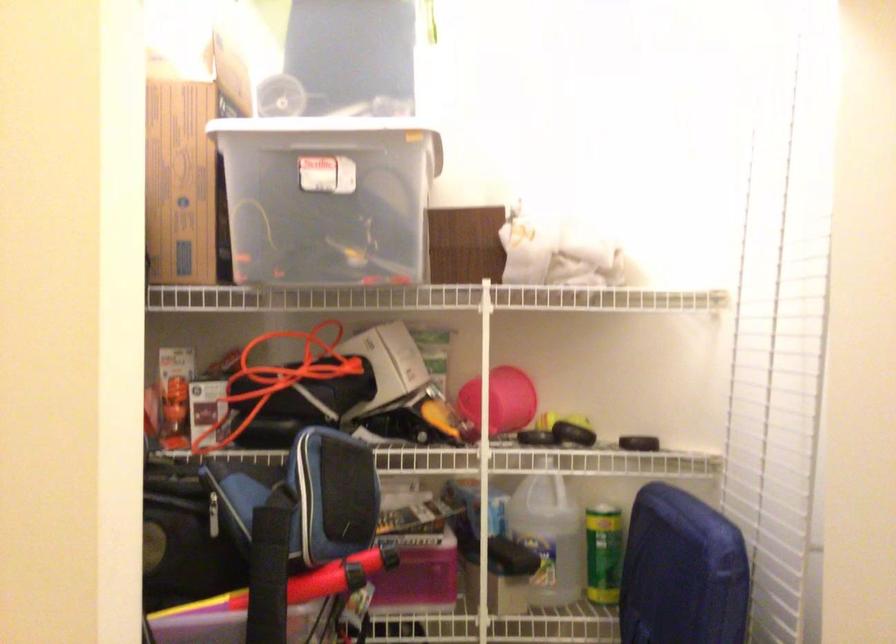
Question: The first image is from the beginning of the video and the second image is from the end. How did the camera likely rotate when shooting the video?

Choices:
 (A) Left
 (B) Right
 (C) Up
 (D) Down

Answer: (B)